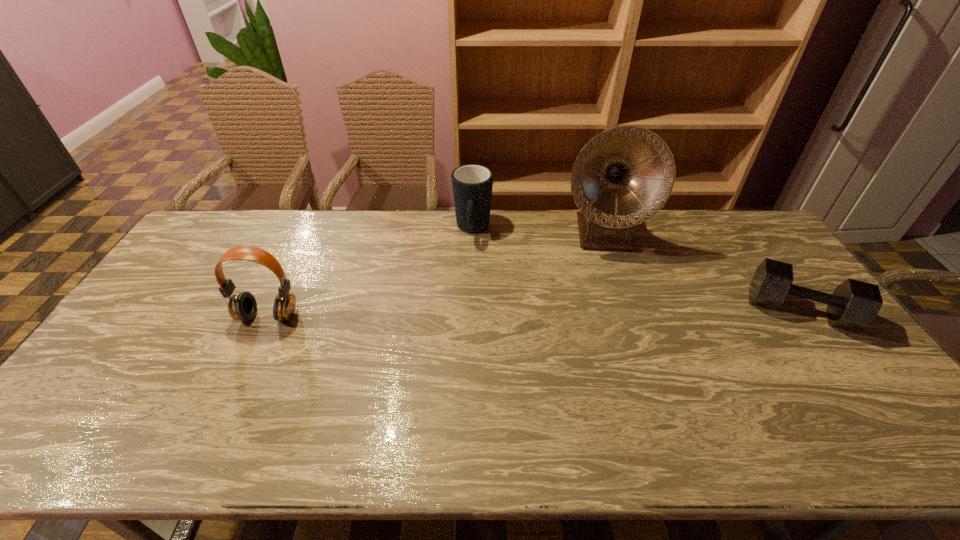
This screenshot has width=960, height=540. In order to click on empty space that is in between the mug and the rightmost object in this screenshot , I will do `click(636, 270)`.

Identify which object is the second closest to the second object from left to right. Please provide its 2D coordinates. Your answer should be formatted as a tuple, i.e. [(x, y)], where the tuple contains the x and y coordinates of a point satisfying the conditions above.

[(242, 306)]

At what (x,y) coordinates should I click in order to perform the action: click on object that is the second nearest to the tallest object. Please return your answer as a coordinate pair (x, y). The image size is (960, 540). Looking at the image, I should click on tap(853, 306).

Locate an element on the screen. The width and height of the screenshot is (960, 540). vacant space that satisfies the following two spatial constraints: 1. on the front side of the shortest object; 2. on the left side of the phonograph record is located at coordinates (626, 310).

Identify the location of vacant region that satisfies the following two spatial constraints: 1. on the front side of the mug; 2. on the right side of the second object from right to left. (472, 234).